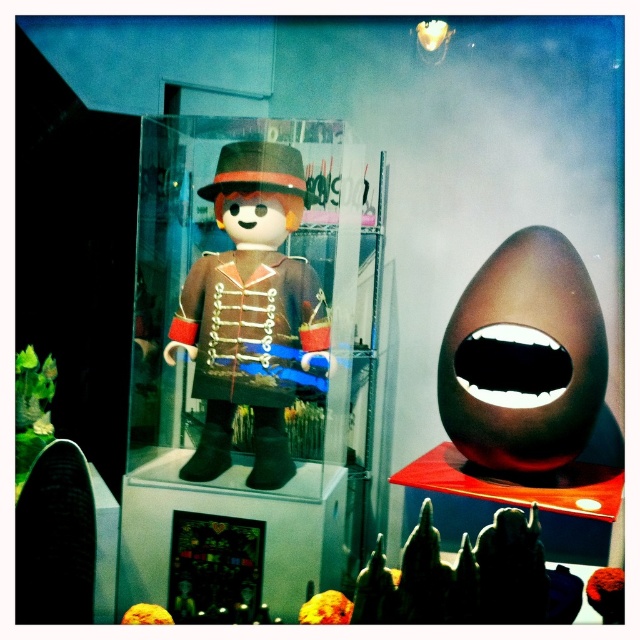
Which is more to the left, velvet-like red plush at center or orange matte ball at lower left?

From the viewer's perspective, orange matte ball at lower left appears more on the left side.

From the picture: Who is more distant from viewer, (612, 608) or (163, 621)?

Positioned behind is point (612, 608).

What do you see at coordinates (605, 593) in the screenshot?
I see `velvet-like red plush at center` at bounding box center [605, 593].

Locate an element on the screen. This screenshot has height=640, width=640. velvet-like red plush at center is located at coordinates (605, 593).

Does matte brown toy at center appear on the left side of golden textured ball at center?

Correct, you'll find matte brown toy at center to the left of golden textured ball at center.

Locate an element on the screen. The width and height of the screenshot is (640, 640). matte brown toy at center is located at coordinates (250, 312).

Consider the image. Can you confirm if matte brown egg at upper right is positioned above golden textured ball at center?

Yes.

Is matte brown egg at upper right further to camera compared to golden textured ball at center?

That is True.

At what (x,y) coordinates should I click in order to perform the action: click on matte brown egg at upper right. Please return your answer as a coordinate pair (x, y). Looking at the image, I should click on (524, 356).